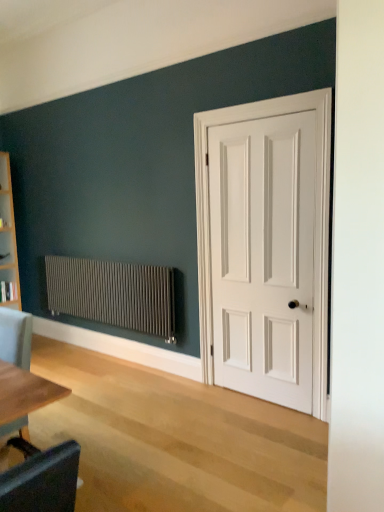
Locate an element on the screen. vacant region below matte gray radiator at left (from a real-world perspective) is located at coordinates (125, 364).